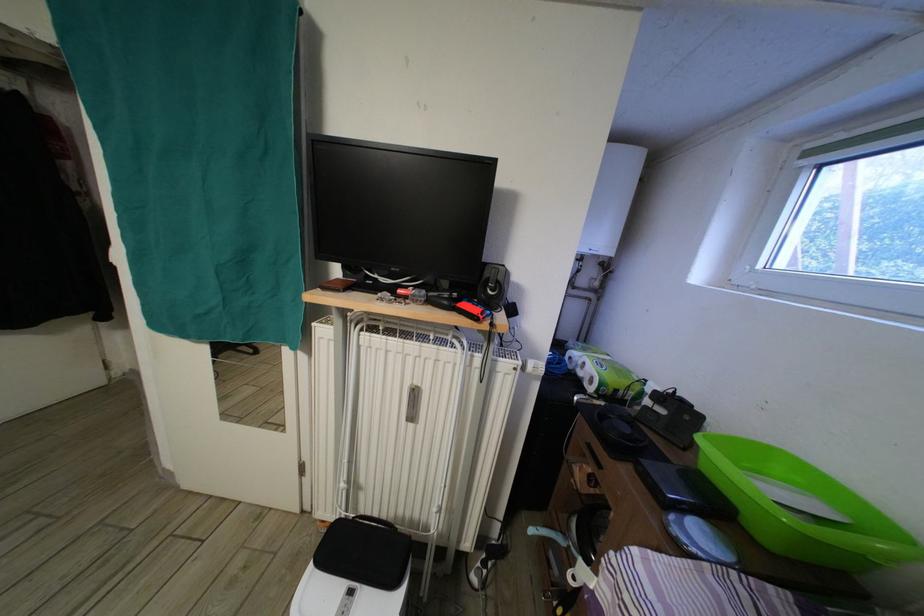
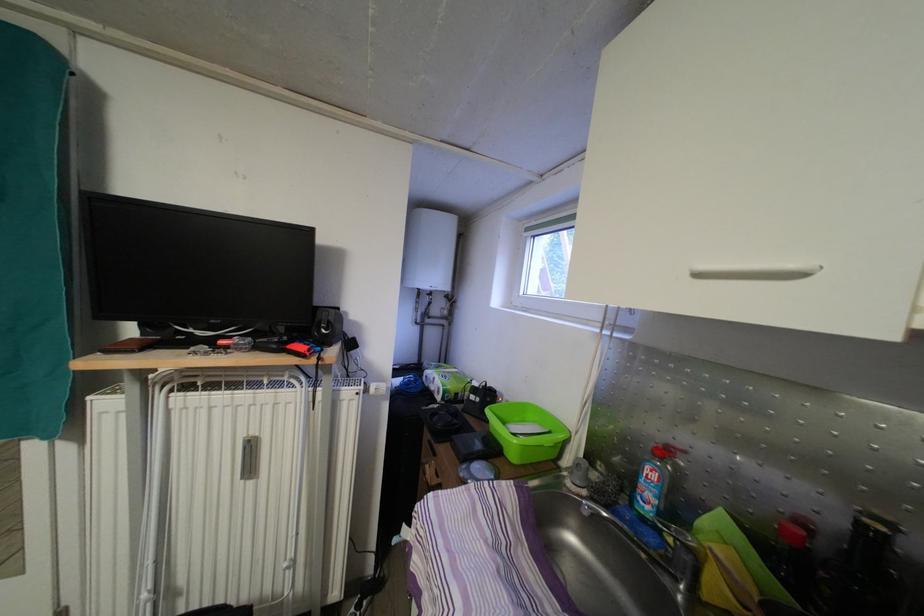
The point at (x=527, y=370) is marked in the first image. Where is the corresponding point in the second image?

(369, 394)